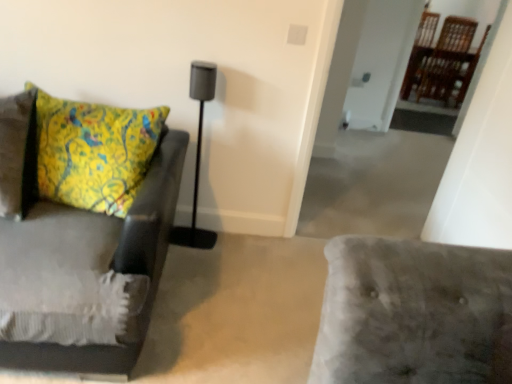
Locate an element on the screen. vacant area that is in front of matte black speaker at center is located at coordinates (187, 260).